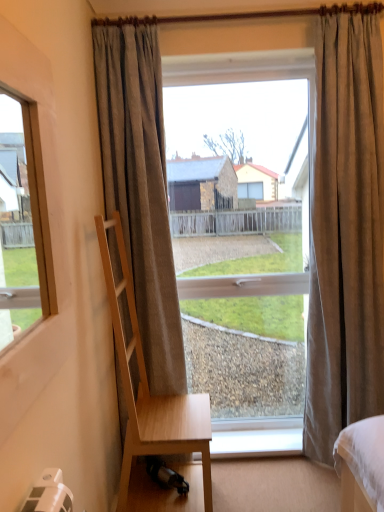
Question: In terms of size, does light wood chair at left appear bigger or smaller than brown textured curtain at right, which is the 2th curtain in left-to-right order?

Choices:
 (A) small
 (B) big

Answer: (A)

Question: Is light wood chair at left spatially inside brown textured curtain at right, which is the 2th curtain in left-to-right order, or outside of it?

Choices:
 (A) outside
 (B) inside

Answer: (A)

Question: Considering the real-world distances, which object is farthest from the light wood chair at left?

Choices:
 (A) gray textured curtain at center, which is the first curtain in left-to-right order
 (B) clear glass window at center
 (C) brown textured curtain at right, the 1th curtain positioned from the right
 (D) white plastic window sill at lower center

Answer: (C)

Question: Considering the real-world distances, which object is closest to the brown textured curtain at right, which is the 2th curtain in left-to-right order?

Choices:
 (A) gray textured curtain at center, which is the first curtain in left-to-right order
 (B) clear glass window at center
 (C) light wood chair at left
 (D) white plastic window sill at lower center

Answer: (B)